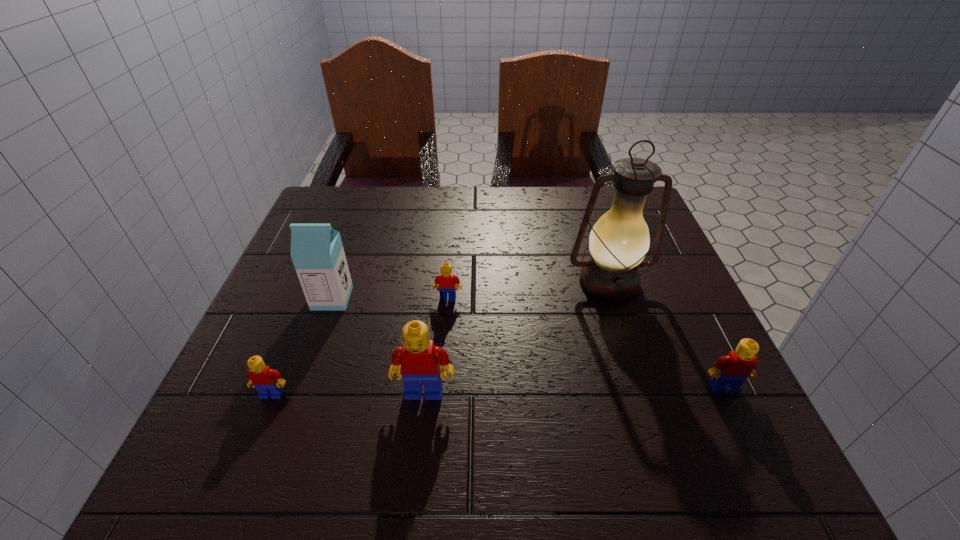
Image resolution: width=960 pixels, height=540 pixels. I want to click on free space located 0.220m on the back of the milk carton, so click(x=357, y=228).

Find the location of a particular element. The width and height of the screenshot is (960, 540). Lego located in the left edge section of the desktop is located at coordinates (267, 382).

This screenshot has height=540, width=960. Find the location of `milk carton positioned at the left edge`. milk carton positioned at the left edge is located at coordinates (317, 252).

Identify the location of Lego positioned at the right edge. The width and height of the screenshot is (960, 540). (729, 372).

The height and width of the screenshot is (540, 960). I want to click on oil lamp situated at the right edge, so click(619, 240).

Where is `object that is at the near left corner`? object that is at the near left corner is located at coordinates (267, 382).

I want to click on object positioned at the near right corner, so click(729, 372).

In the image, there is a desktop. Where is `vacant area at the far edge`? Image resolution: width=960 pixels, height=540 pixels. vacant area at the far edge is located at coordinates (540, 191).

At what (x,y) coordinates should I click in order to perform the action: click on vacant position at the near edge of the desktop. Please return your answer as a coordinate pair (x, y). Looking at the image, I should click on (480, 390).

In the image, there is a desktop. At what (x,y) coordinates should I click in order to perform the action: click on free space at the left edge. Please return your answer as a coordinate pair (x, y). This screenshot has height=540, width=960. Looking at the image, I should click on (277, 305).